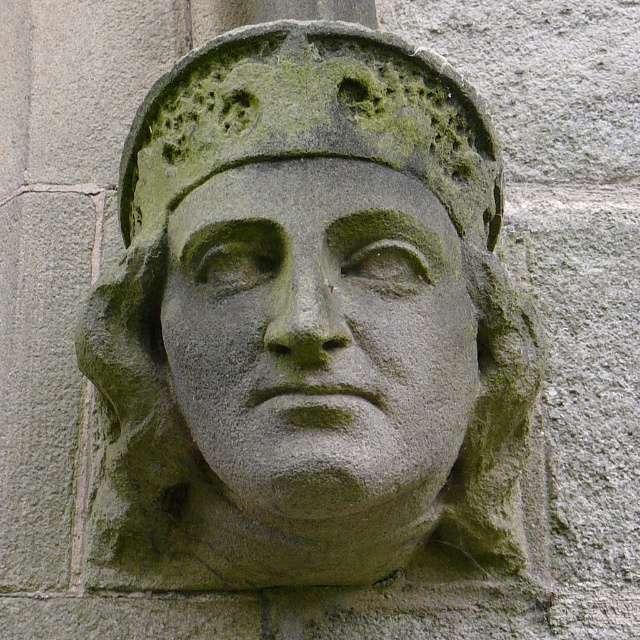
Does green stone head at center have a lesser height compared to green stone face at center?

In fact, green stone head at center may be taller than green stone face at center.

Between green stone head at center and green stone face at center, which one is positioned lower?

green stone head at center

Is point (188, 262) positioned after point (307, 253)?

Yes, it is.

Identify the location of green stone head at center. Image resolution: width=640 pixels, height=640 pixels. (308, 321).